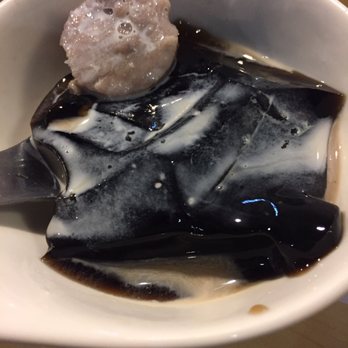
This screenshot has width=348, height=348. I want to click on table, so click(330, 334).